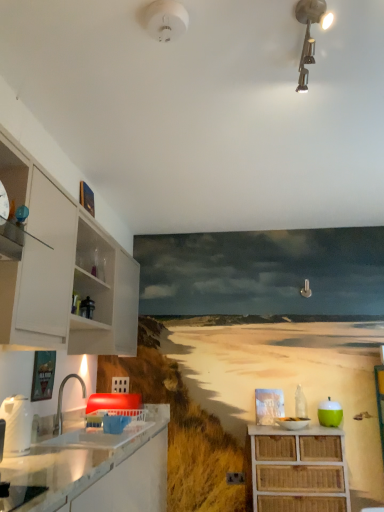
Find the location of `vacant point above woven wood cabinet at lower right, the first cabinetry in the right-to-left sequence (from a real-world perspective)`. vacant point above woven wood cabinet at lower right, the first cabinetry in the right-to-left sequence (from a real-world perspective) is located at coordinates (294, 422).